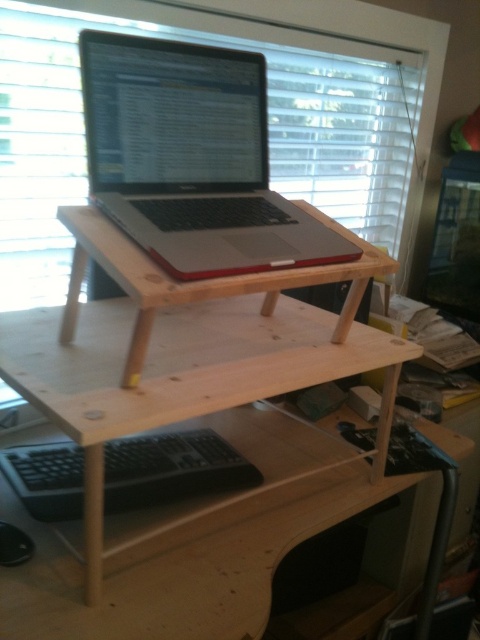
Question: Which point appears closest to the camera in this image?

Choices:
 (A) (205, 432)
 (B) (136, 157)
 (C) (322, 221)

Answer: (B)

Question: Which of the following is the closest to the observer?

Choices:
 (A) (145, 353)
 (B) (162, 131)
 (C) (215, 481)

Answer: (A)

Question: Does satin silver laptop at center have a smaller size compared to black matte keyboard at lower center?

Choices:
 (A) no
 (B) yes

Answer: (A)

Question: Among these objects, which one is farthest from the camera?

Choices:
 (A) satin silver laptop at center
 (B) black matte keyboard at lower center
 (C) natural wood laptop stand at center

Answer: (B)

Question: Is satin silver laptop at center closer to the viewer compared to black matte keyboard at lower center?

Choices:
 (A) no
 (B) yes

Answer: (B)

Question: Is satin silver laptop at center behind natural wood laptop stand at center?

Choices:
 (A) yes
 (B) no

Answer: (A)